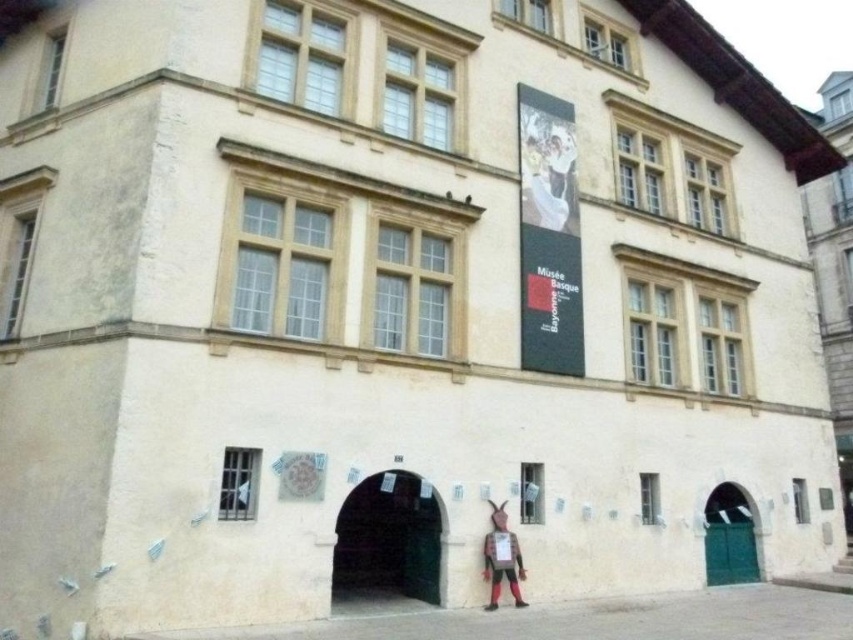
Question: Which point is farther to the camera?

Choices:
 (A) matte brown figure at lower center
 (B) matte white dress at upper center

Answer: (B)

Question: Observing the image, what is the correct spatial positioning of matte white dress at upper center in reference to matte brown figure at lower center?

Choices:
 (A) right
 (B) left

Answer: (A)

Question: Does matte white dress at upper center appear on the right side of matte brown figure at lower center?

Choices:
 (A) no
 (B) yes

Answer: (B)

Question: Among these points, which one is nearest to the camera?

Choices:
 (A) (554, 216)
 (B) (511, 554)

Answer: (B)

Question: Is matte white dress at upper center to the left of matte brown figure at lower center from the viewer's perspective?

Choices:
 (A) yes
 (B) no

Answer: (B)